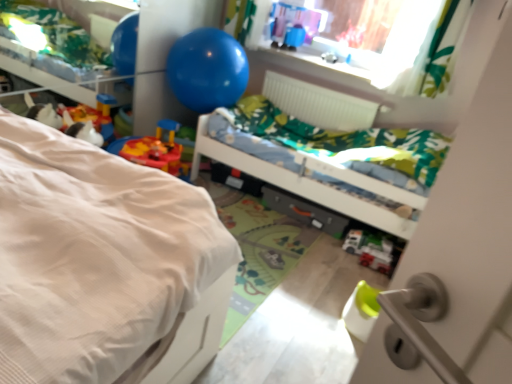
Question: From the image's perspective, relative to white plastic toy car at lower center, the 2th toy viewed from the back, is metallic gray drawer at center above or below?

Choices:
 (A) below
 (B) above

Answer: (B)

Question: Considering the positions of point (281, 200) and point (367, 256), is point (281, 200) closer or farther from the camera than point (367, 256)?

Choices:
 (A) closer
 (B) farther

Answer: (B)

Question: Which of these objects is positioned closest to the white plastic radiator at upper center?

Choices:
 (A) blue rubber balloon at upper center
 (B) white plastic toy car at lower center, marked as the 1th toy in a right-to-left arrangement
 (C) matte plastic toy at upper center, which is the 1th toy from back to front
 (D) white textured bed at left, the second bed viewed from the back
 (E) green fabric bed at center, which is the 2th bed in front-to-back order

Answer: (C)

Question: Estimate the real-world distances between objects in this image. Which object is closer to the white plastic radiator at upper center?

Choices:
 (A) white textured bed at left, the second bed viewed from the back
 (B) white plastic toy car at lower center, the 2th toy viewed from the back
 (C) blue rubber balloon at upper center
 (D) green fabric bed at center, which is the first bed from back to front
 (E) metallic gray drawer at center

Answer: (C)